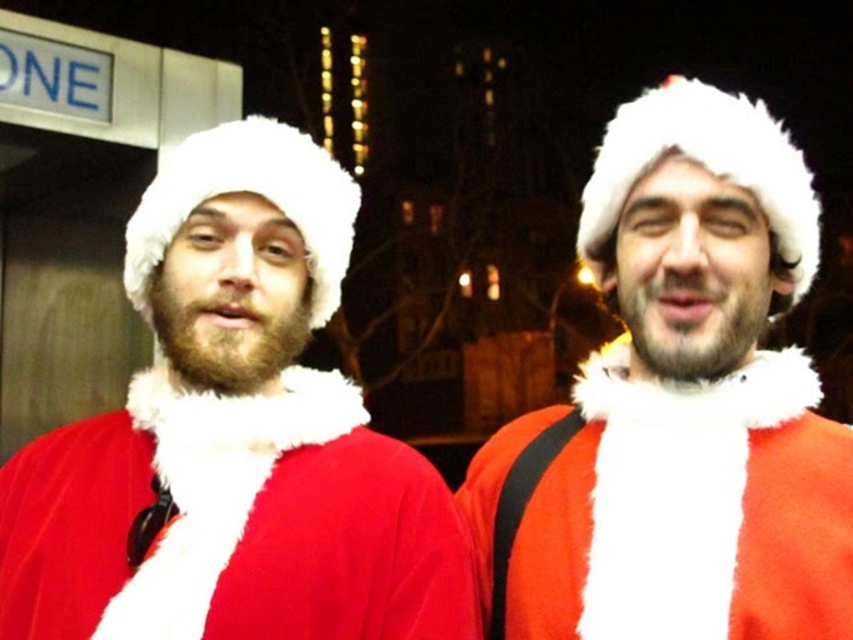
Who is positioned more to the right, velvet red santa suit at center or matte red santa suit at center?

Positioned to the right is matte red santa suit at center.

Is velvet red santa suit at center wider than matte red santa suit at center?

Yes, velvet red santa suit at center is wider than matte red santa suit at center.

Locate an element on the screen. This screenshot has width=853, height=640. velvet red santa suit at center is located at coordinates (234, 436).